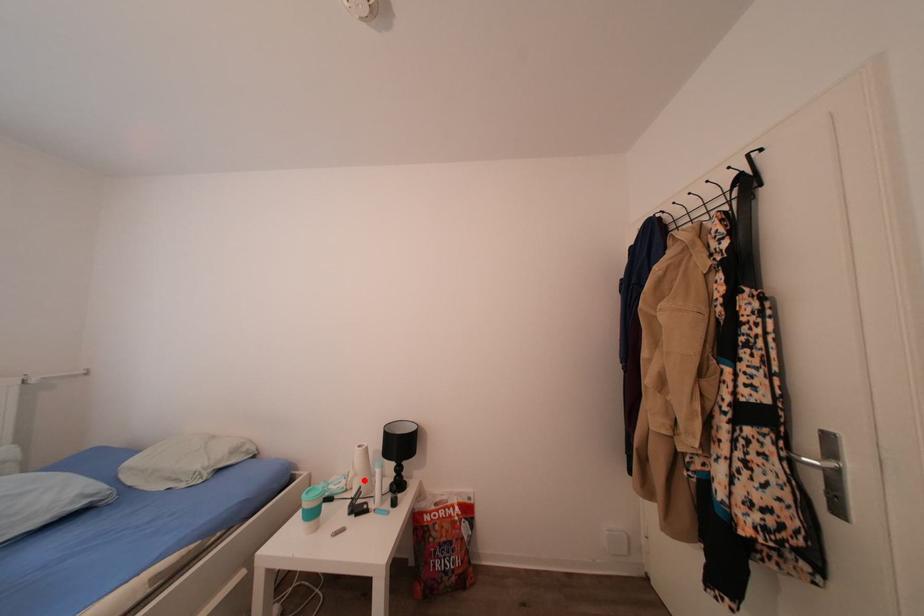
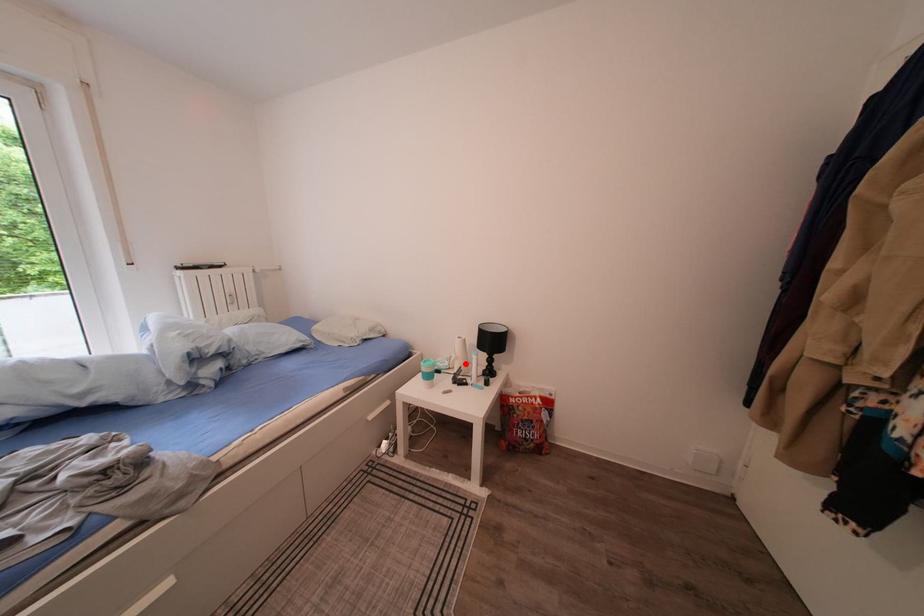
I am providing you with two images of the same scene from different viewpoints. A red point is marked on the first image and another point is marked on the second image. Is the marked point in image1 the same physical position as the marked point in image2?

Yes